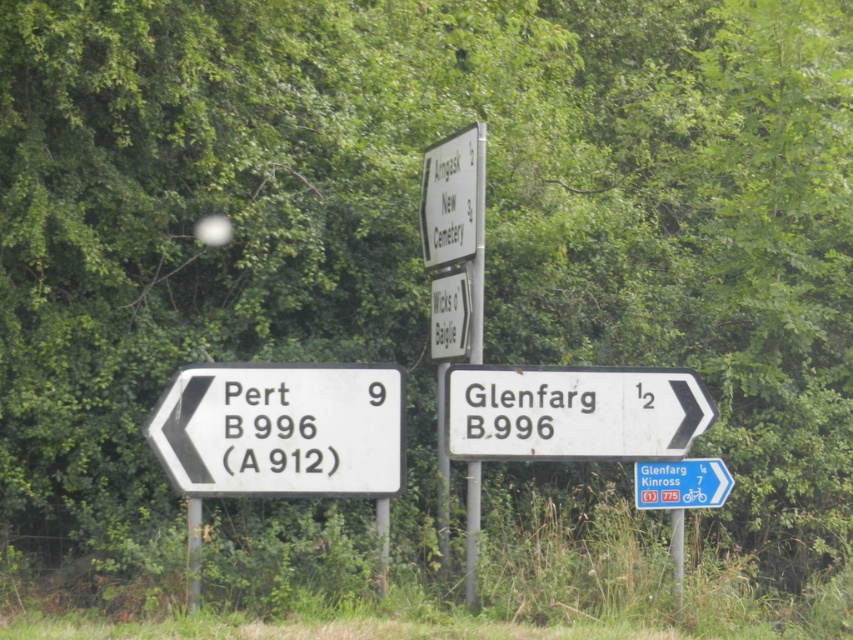
Is white plastic signpost at center positioned before blue plastic sign at center?

Yes, it is.

Does white plastic signpost at center appear over blue plastic sign at center?

Yes.

Does point (483, 209) come farther from viewer compared to point (688, 480)?

That is False.

The width and height of the screenshot is (853, 640). Find the location of `white plastic signpost at center`. white plastic signpost at center is located at coordinates (477, 253).

Does point (224, 406) lie in front of point (537, 403)?

Yes, it is in front of point (537, 403).

Which is in front, point (172, 413) or point (537, 387)?

Positioned in front is point (172, 413).

Identify the location of white plastic sign at left. This screenshot has width=853, height=640. click(281, 429).

Who is lower down, white plastic sign at center right or white plastic signpost at center?

white plastic sign at center right is lower down.

Locate an element on the screen. white plastic sign at center right is located at coordinates [x=573, y=412].

This screenshot has height=640, width=853. What do you see at coordinates (573, 412) in the screenshot?
I see `white plastic sign at center right` at bounding box center [573, 412].

Image resolution: width=853 pixels, height=640 pixels. What are the coordinates of `white plastic sign at center right` in the screenshot? It's located at (x=573, y=412).